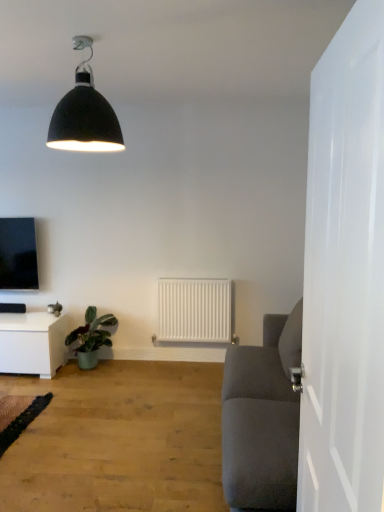
Question: From a real-world perspective, is white matte radiator at center located higher than green glossy plant at lower left?

Choices:
 (A) no
 (B) yes

Answer: (B)

Question: Is white matte radiator at center next to green glossy plant at lower left and touching it?

Choices:
 (A) no
 (B) yes

Answer: (A)

Question: Does white matte radiator at center have a lesser height compared to green glossy plant at lower left?

Choices:
 (A) no
 (B) yes

Answer: (A)

Question: Is white matte radiator at center to the right of green glossy plant at lower left from the viewer's perspective?

Choices:
 (A) yes
 (B) no

Answer: (A)

Question: Could green glossy plant at lower left be considered to be inside white matte radiator at center?

Choices:
 (A) no
 (B) yes

Answer: (A)

Question: Is point (54, 124) closer or farther from the camera than point (360, 25)?

Choices:
 (A) farther
 (B) closer

Answer: (A)

Question: From a real-world perspective, is matte black lampshade at upper center physically located above or below white glossy door at right?

Choices:
 (A) above
 (B) below

Answer: (A)

Question: Would you say matte black lampshade at upper center is inside or outside white glossy door at right?

Choices:
 (A) inside
 (B) outside

Answer: (B)

Question: Looking at their shapes, would you say matte black lampshade at upper center is wider or thinner than white glossy door at right?

Choices:
 (A) thin
 (B) wide

Answer: (B)

Question: Considering the positions of point (3, 245) and point (99, 95), is point (3, 245) closer or farther from the camera than point (99, 95)?

Choices:
 (A) farther
 (B) closer

Answer: (A)

Question: From a real-world perspective, is matte black tv at upper left above or below matte black lampshade at upper center?

Choices:
 (A) below
 (B) above

Answer: (A)

Question: Considering the relative positions of matte black tv at upper left and matte black lampshade at upper center in the image provided, is matte black tv at upper left to the left or to the right of matte black lampshade at upper center?

Choices:
 (A) left
 (B) right

Answer: (A)

Question: Considering their positions, is matte black tv at upper left located in front of or behind matte black lampshade at upper center?

Choices:
 (A) front
 (B) behind

Answer: (B)

Question: Does point (4, 239) appear closer or farther from the camera than point (29, 322)?

Choices:
 (A) closer
 (B) farther

Answer: (B)

Question: Is matte black tv at upper left wider or thinner than white glossy table at lower left?

Choices:
 (A) wide
 (B) thin

Answer: (B)